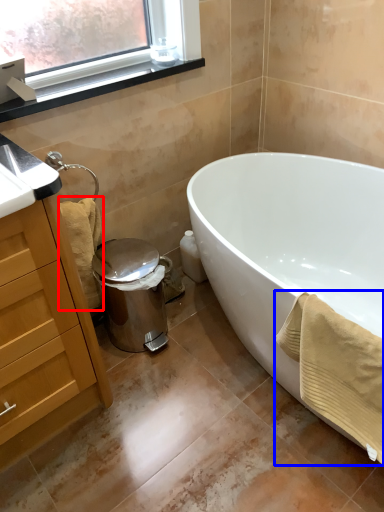
Question: Which object is further to the camera taking this photo, bath towel (highlighted by a red box) or bath towel (highlighted by a blue box)?

Choices:
 (A) bath towel
 (B) bath towel

Answer: (A)